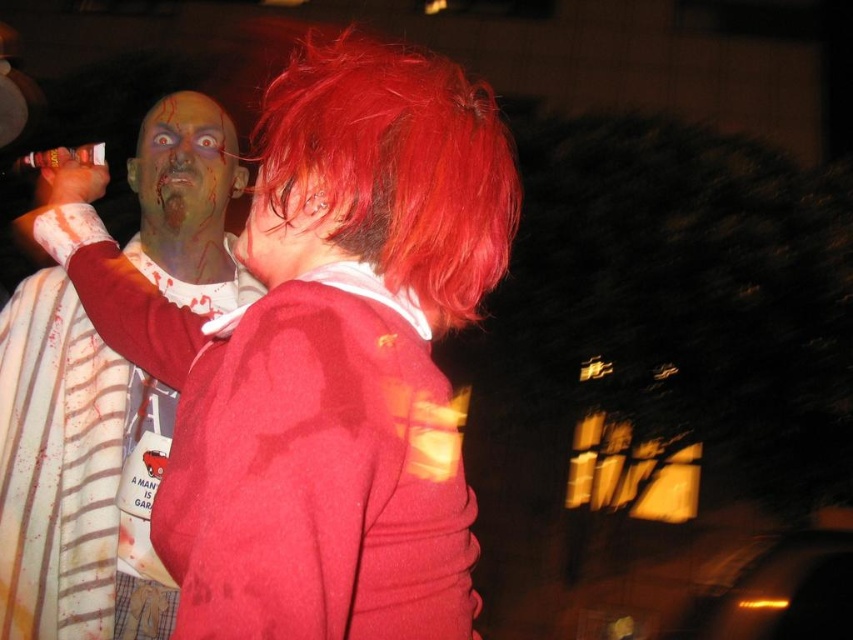
Is greenish matte face at upper left wider than smooth red wig at center?

Indeed, greenish matte face at upper left has a greater width compared to smooth red wig at center.

This screenshot has width=853, height=640. Find the location of `greenish matte face at upper left`. greenish matte face at upper left is located at coordinates (184, 164).

Can you confirm if matte red wig at upper center is bigger than matte white shirt at left?

Yes, matte red wig at upper center is bigger than matte white shirt at left.

Is point (477, 136) in front of point (38, 570)?

Yes, point (477, 136) is in front of point (38, 570).

Who is more forward, (405, 52) or (39, 340)?

Point (39, 340) is in front.

At what (x,y) coordinates should I click in order to perform the action: click on matte red wig at upper center. Please return your answer as a coordinate pair (x, y). This screenshot has height=640, width=853. Looking at the image, I should click on (346, 371).

Is matte white shirt at left bigger than smooth red wig at center?

Correct, matte white shirt at left is larger in size than smooth red wig at center.

Which is in front, point (199, 236) or point (302, 256)?

Point (302, 256) is in front.

Image resolution: width=853 pixels, height=640 pixels. Describe the element at coordinates (68, 472) in the screenshot. I see `matte white shirt at left` at that location.

You are a GUI agent. You are given a task and a screenshot of the screen. Output one action in this format:
    pyautogui.click(x=<x>, y=<y>)
    Task: Click on the matte white shirt at left
    
    Given the screenshot: What is the action you would take?
    pyautogui.click(x=68, y=472)